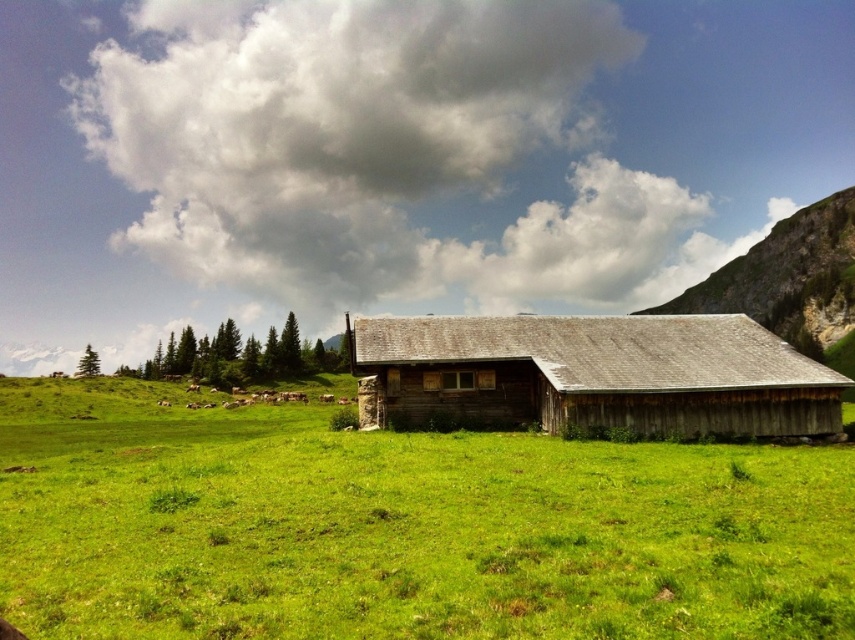
Question: Which object is the farthest from the weathered wood barn at center?

Choices:
 (A) white woolly cows at lower left
 (B) green grassy field at center
 (C) cloudy sky at upper center

Answer: (C)

Question: Which object is farther from the camera taking this photo?

Choices:
 (A) white woolly cows at lower left
 (B) cloudy sky at upper center

Answer: (B)

Question: Which of these objects is positioned closest to the weathered wood barn at center?

Choices:
 (A) green grassy field at center
 (B) cloudy sky at upper center
 (C) white woolly cows at lower left

Answer: (A)

Question: Can you confirm if green grassy field at center is positioned to the right of cloudy sky at upper center?

Choices:
 (A) no
 (B) yes

Answer: (B)

Question: Where is green grassy field at center located in relation to cloudy sky at upper center in the image?

Choices:
 (A) above
 (B) below

Answer: (B)

Question: Considering the relative positions of green grassy field at center and white woolly cows at lower left in the image provided, where is green grassy field at center located with respect to white woolly cows at lower left?

Choices:
 (A) right
 (B) left

Answer: (A)